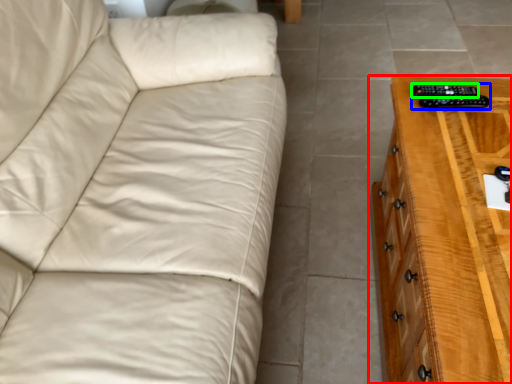
Question: Which is farther away from chest of drawers (highlighted by a red box)? control (highlighted by a blue box) or remote (highlighted by a green box)?

Choices:
 (A) control
 (B) remote

Answer: (B)